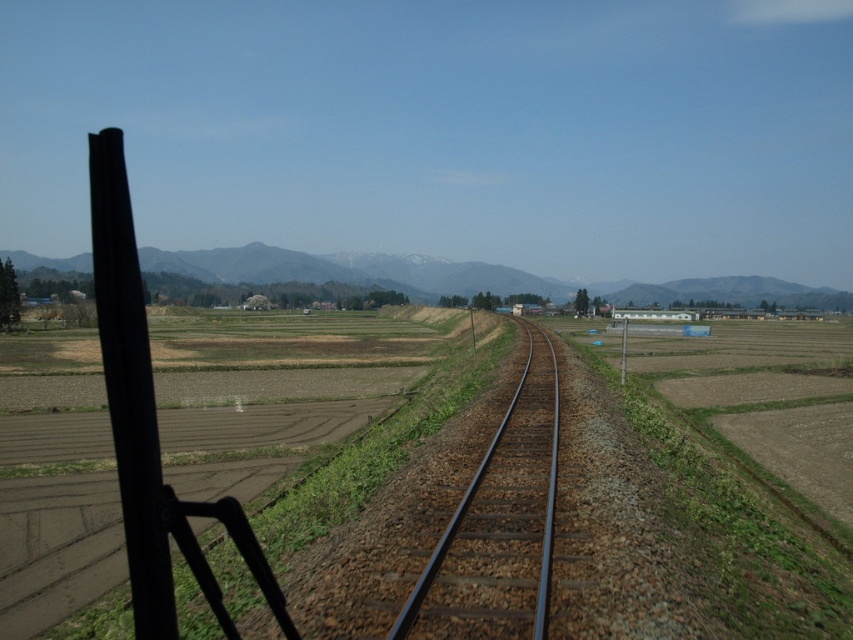
You are standing at the edge of the train window and see the metallic train track at center. If you want to walk towards the horizon along the track, in which direction should you move relative to the track?

The metallic train track at center curves slightly to the right as it vanishes into the horizon, so you should move in the direction towards the right to follow the track towards the horizon.